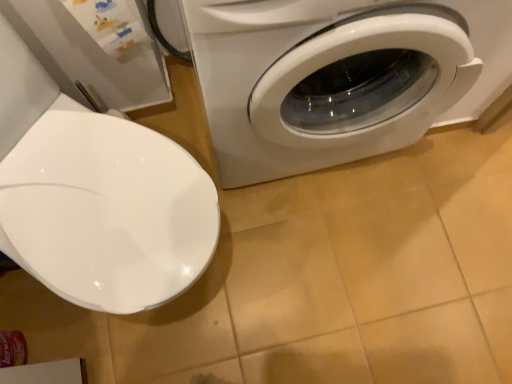
This screenshot has width=512, height=384. In order to click on empty space that is in between white glossy toilet seat at left and white glossy washing machine at right in this screenshot , I will do `click(254, 196)`.